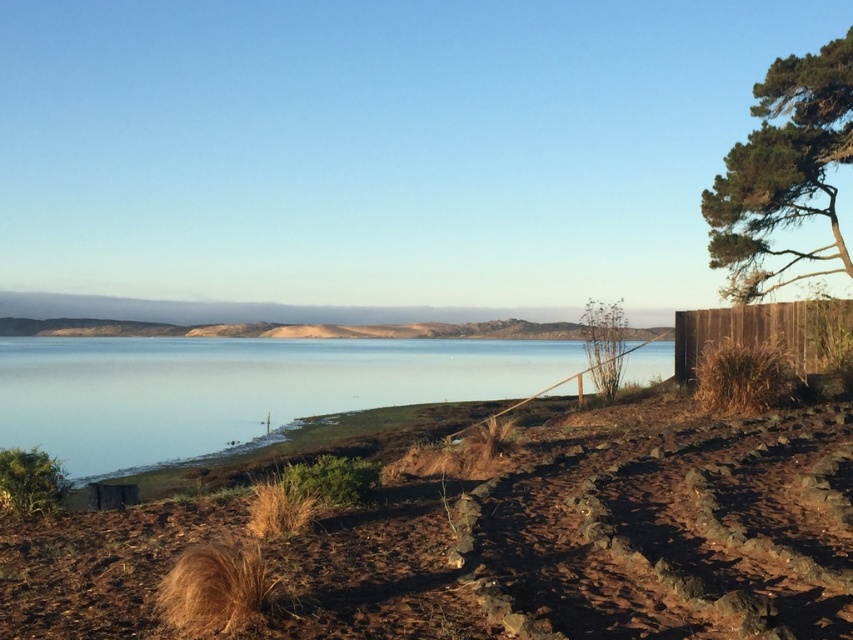
Question: Which of the following is the farthest from the observer?

Choices:
 (A) (0, 570)
 (B) (268, 436)
 (C) (822, 173)
 (D) (679, 330)

Answer: (C)

Question: Which point appears farthest from the camera in this image?

Choices:
 (A) (793, 349)
 (B) (730, 248)
 (C) (740, 540)
 (D) (137, 422)

Answer: (B)

Question: Which point is closer to the camera?

Choices:
 (A) clear water at center
 (B) brown soil at lower right

Answer: (B)

Question: Can you confirm if green textured tree at upper right is wider than brown wooden fence at right?

Choices:
 (A) no
 (B) yes

Answer: (B)

Question: Does clear water at center appear on the left side of brown wooden fence at right?

Choices:
 (A) no
 (B) yes

Answer: (B)

Question: Is brown soil at lower right closer to camera compared to brown wooden fence at right?

Choices:
 (A) no
 (B) yes

Answer: (B)